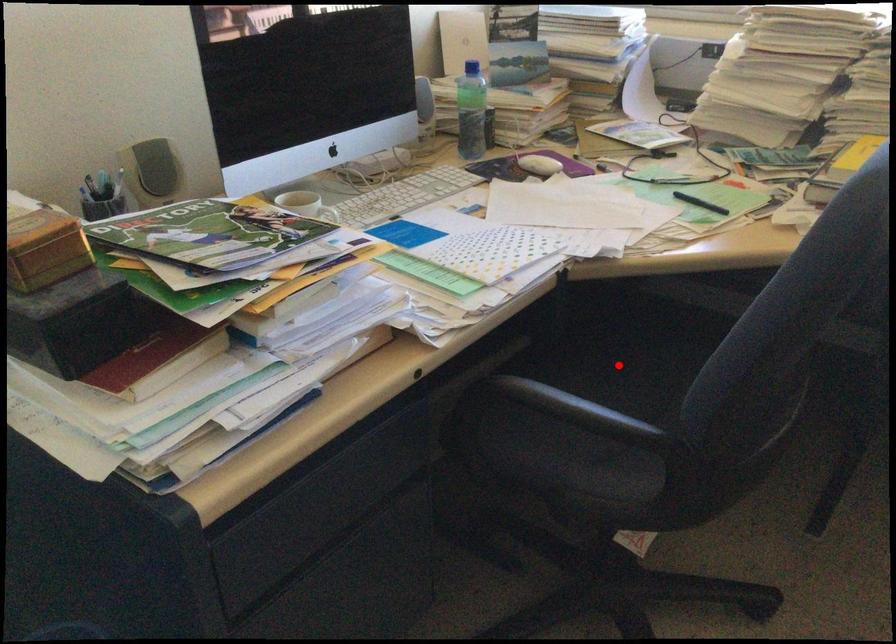
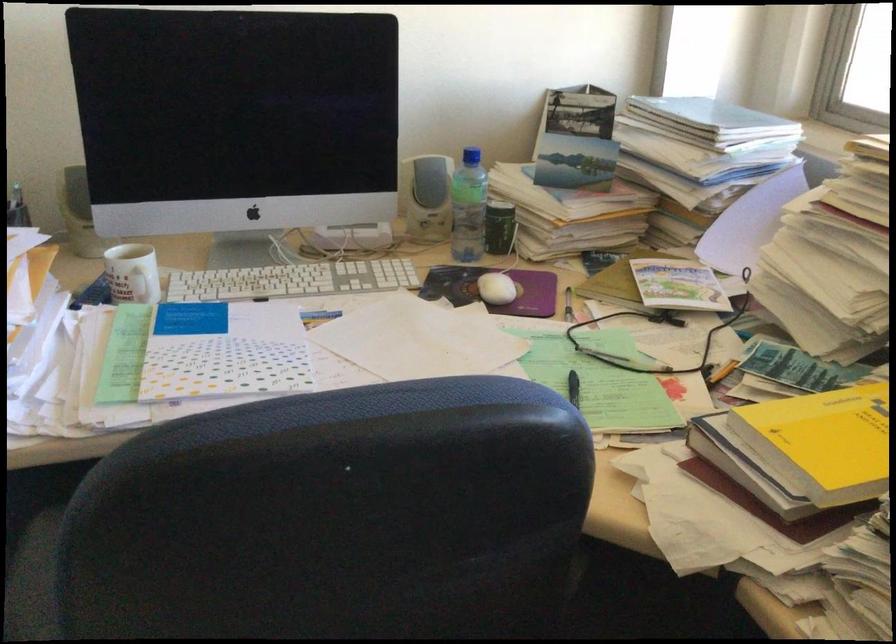
Question: I am providing you with two images of the same scene from different viewpoints. A red point is marked on the first image. At the location where the point appears in image 1, is it still visible in image 2?

Choices:
 (A) Yes
 (B) No

Answer: (B)